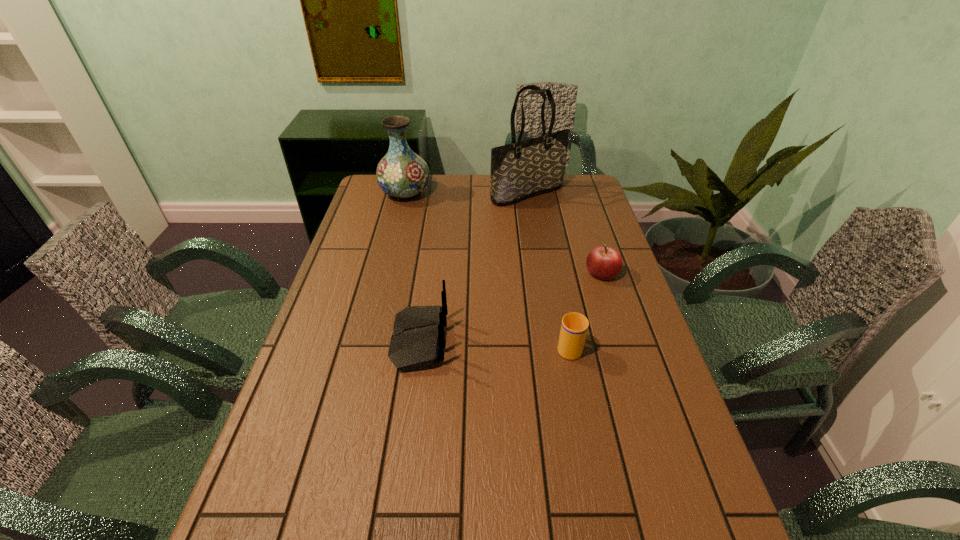
Where is `free space between the second tallest object and the router`? The height and width of the screenshot is (540, 960). free space between the second tallest object and the router is located at coordinates (412, 267).

You are a GUI agent. You are given a task and a screenshot of the screen. Output one action in this format:
    pyautogui.click(x=<x>, y=<y>)
    Task: Click on the vacant area between the tallest object and the router
    
    Given the screenshot: What is the action you would take?
    click(473, 267)

What are the coordinates of `free space between the router and the apple` in the screenshot? It's located at (511, 307).

Locate which object ranks second in proximity to the cup. Please provide its 2D coordinates. Your answer should be formatted as a tuple, i.e. [(x, y)], where the tuple contains the x and y coordinates of a point satisfying the conditions above.

[(417, 342)]

Image resolution: width=960 pixels, height=540 pixels. Find the location of `object that is the fourth nearest to the cup`. object that is the fourth nearest to the cup is located at coordinates (401, 173).

The width and height of the screenshot is (960, 540). In order to click on free point that satisfies the following two spatial constraints: 1. on the side of the third nearest object with the handle; 2. on the left side of the cup in this screenshot , I will do `click(555, 273)`.

In order to click on free space that satisfies the following two spatial constraints: 1. on the front side of the apple; 2. on the back of the router in this screenshot , I will do `click(623, 341)`.